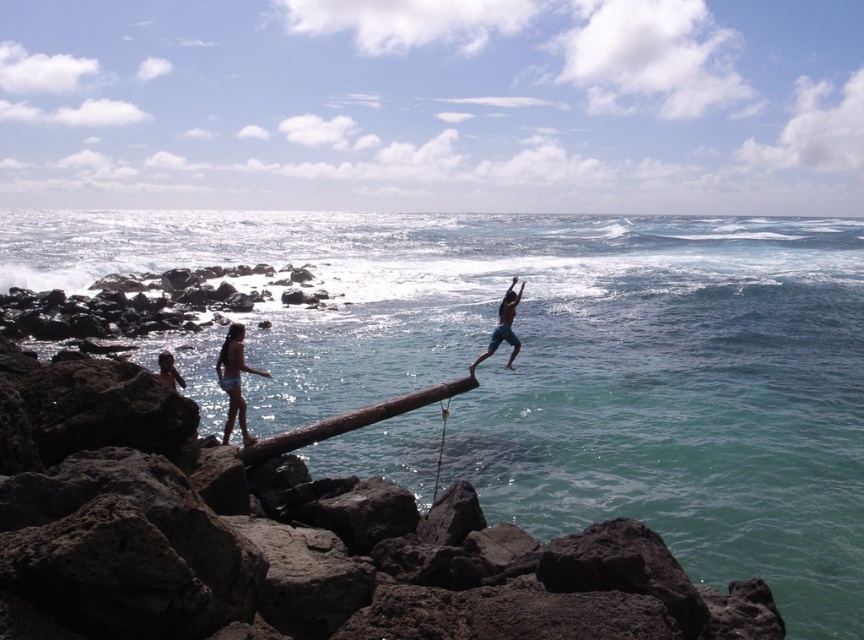
You are a photographer trying to capture the perfect shot of the brown wood log at center. The camera has a grid overlay with coordinates from 0 to 1 on both axes. Where should you position the camera to ensure the log is centered in the frame?

The brown wood log at center is located at the 2D coordinates point (350,420), so you should position the camera to center the frame at those coordinates to capture the log perfectly.

You are a parent supervising children at the rocky coastline. You need to locate the light brown wooden stick at lower left and the brown wood log at center. Which object is positioned farther to the left?

The light brown wooden stick at lower left is positioned farther to the left since the brown wood log at center is to the right of it.